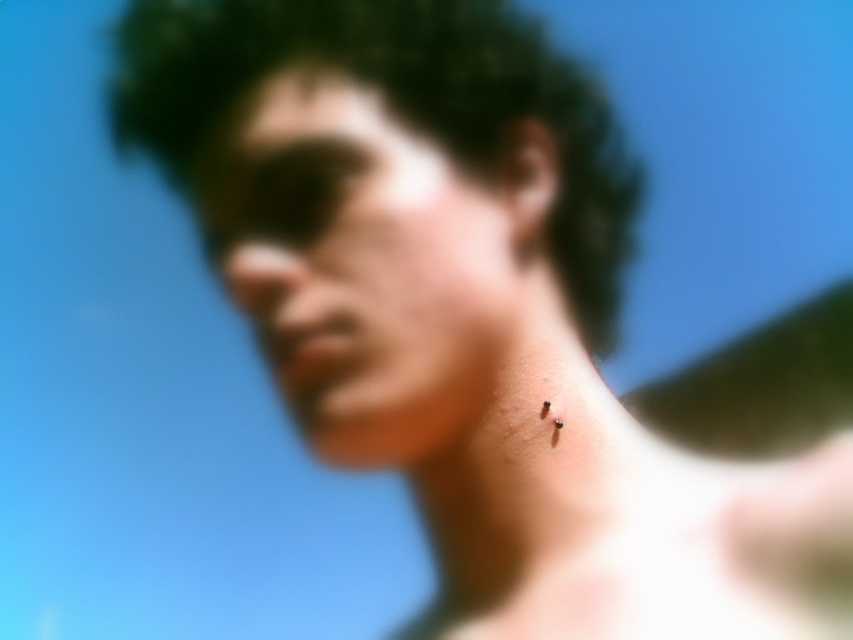
Is point (350, 355) in front of point (404, 3)?

Yes, it is in front of point (404, 3).

Is smooth skin face at center closer to the viewer compared to dark curly hair at center?

That is True.

Is point (480, 413) closer to viewer compared to point (606, 115)?

Yes.

The height and width of the screenshot is (640, 853). I want to click on smooth skin face at center, so click(364, 272).